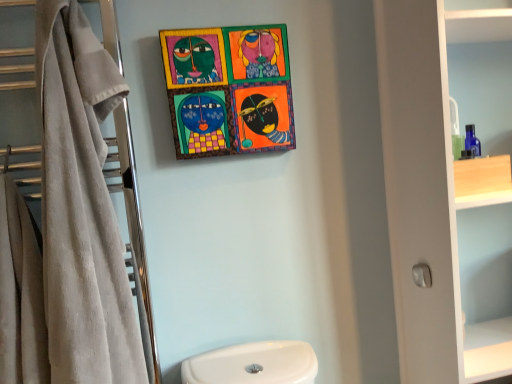
Question: Can you confirm if white matte cabinet at right is shorter than beige towel at left?

Choices:
 (A) yes
 (B) no

Answer: (B)

Question: Is white matte cabinet at right thinner than beige towel at left?

Choices:
 (A) yes
 (B) no

Answer: (B)

Question: Is white matte cabinet at right to the left of beige towel at left from the viewer's perspective?

Choices:
 (A) yes
 (B) no

Answer: (B)

Question: Would you consider white matte cabinet at right to be distant from beige towel at left?

Choices:
 (A) yes
 (B) no

Answer: (B)

Question: Considering the relative positions of white matte cabinet at right and beige towel at left in the image provided, is white matte cabinet at right behind beige towel at left?

Choices:
 (A) no
 (B) yes

Answer: (B)

Question: Is white matte cabinet at right to the left or to the right of beige towel at left in the image?

Choices:
 (A) right
 (B) left

Answer: (A)

Question: Is point (462, 380) positioned closer to the camera than point (130, 195)?

Choices:
 (A) closer
 (B) farther

Answer: (A)

Question: In terms of width, does white matte cabinet at right look wider or thinner when compared to beige towel at left?

Choices:
 (A) wide
 (B) thin

Answer: (A)

Question: Is white matte cabinet at right inside or outside of beige towel at left?

Choices:
 (A) outside
 (B) inside

Answer: (A)

Question: Based on their sizes in the image, would you say beige soft towel at left is bigger or smaller than wooden painted artwork at upper center?

Choices:
 (A) small
 (B) big

Answer: (B)

Question: Looking at their shapes, would you say beige soft towel at left is wider or thinner than wooden painted artwork at upper center?

Choices:
 (A) thin
 (B) wide

Answer: (B)

Question: From the image's perspective, is beige soft towel at left located above or below wooden painted artwork at upper center?

Choices:
 (A) above
 (B) below

Answer: (B)

Question: Considering their positions, is beige soft towel at left located in front of or behind wooden painted artwork at upper center?

Choices:
 (A) front
 (B) behind

Answer: (A)

Question: Is white matte cabinet at right wider or thinner than wooden painted artwork at upper center?

Choices:
 (A) thin
 (B) wide

Answer: (B)

Question: Considering the positions of white matte cabinet at right and wooden painted artwork at upper center in the image, is white matte cabinet at right bigger or smaller than wooden painted artwork at upper center?

Choices:
 (A) small
 (B) big

Answer: (B)